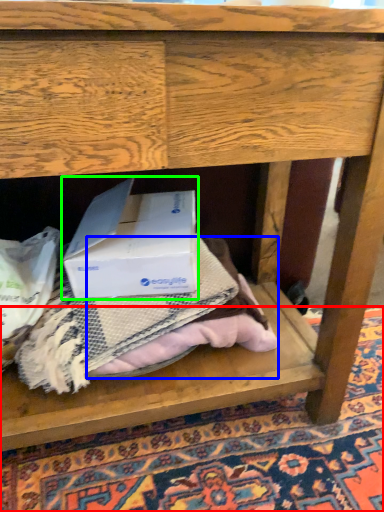
Question: Which object is positioned closest to mat (highlighted by a red box)? Select from clothing (highlighted by a blue box) and box (highlighted by a green box).

Choices:
 (A) clothing
 (B) box

Answer: (A)